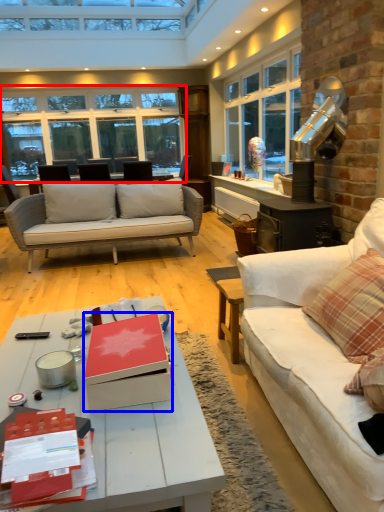
Question: Which object appears closest to the camera in this image, window (highlighted by a red box) or box (highlighted by a blue box)?

Choices:
 (A) window
 (B) box

Answer: (B)